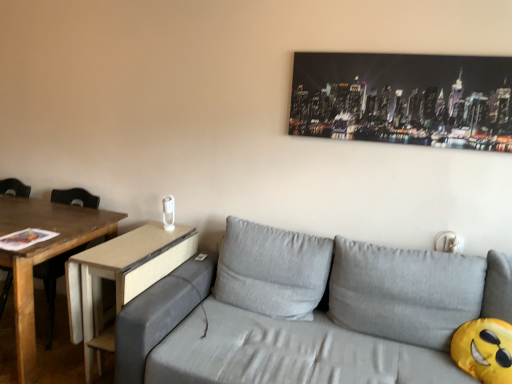
What are the coordinates of `vacant point above metallic cityscape print at upper right (from a real-world perspective)` in the screenshot? It's located at (407, 53).